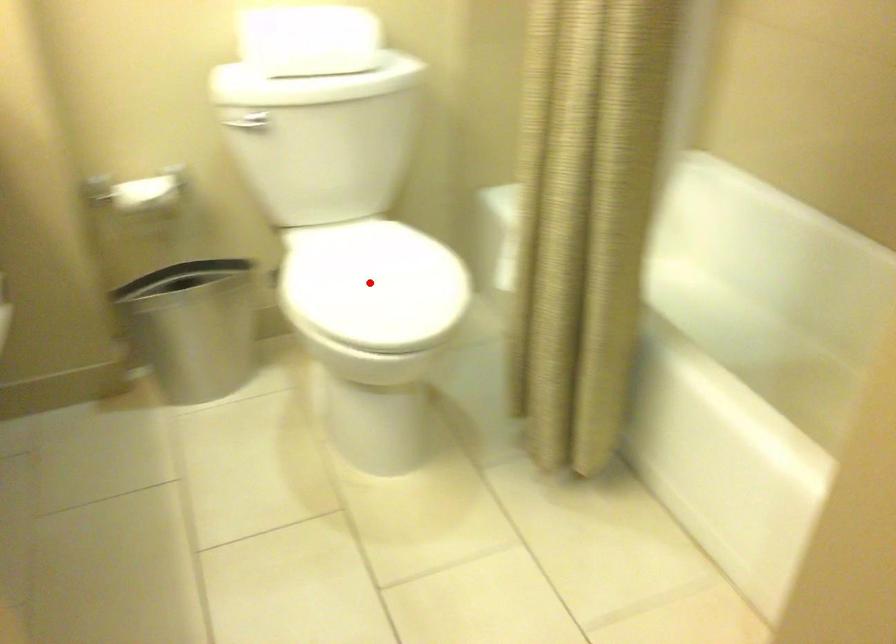
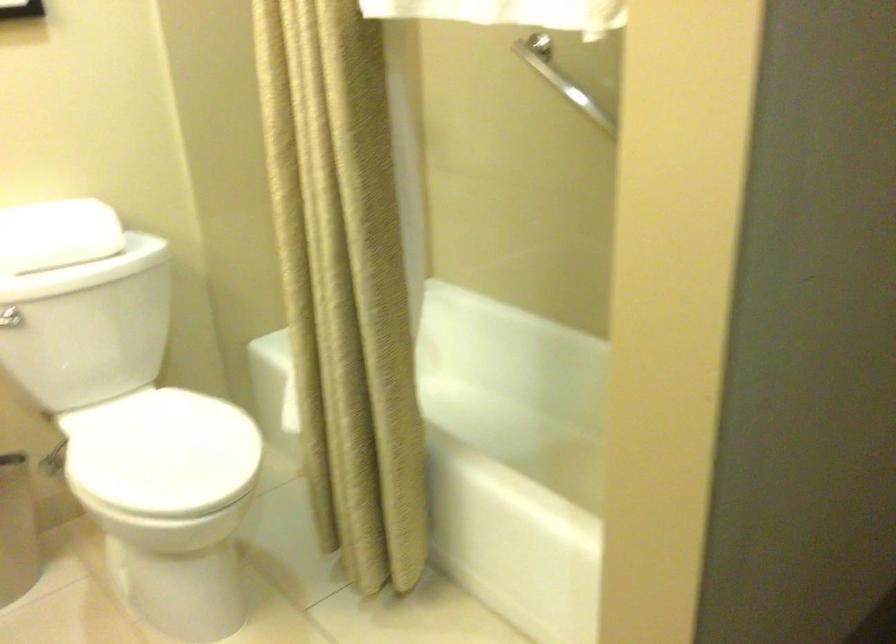
The point at the highlighted location is marked in the first image. Where is the corresponding point in the second image?

(161, 453)